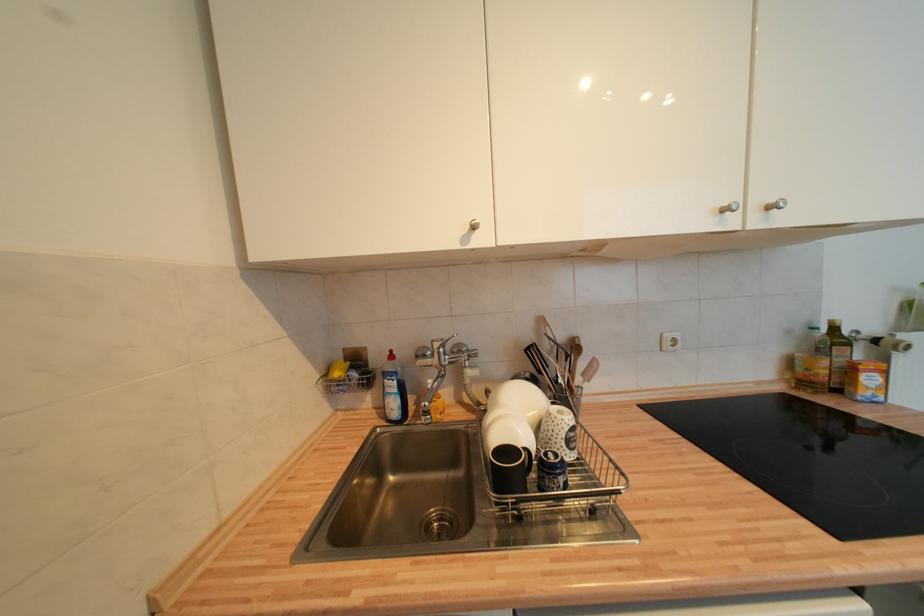
Describe the element at coordinates (508, 469) in the screenshot. I see `a black mug handle` at that location.